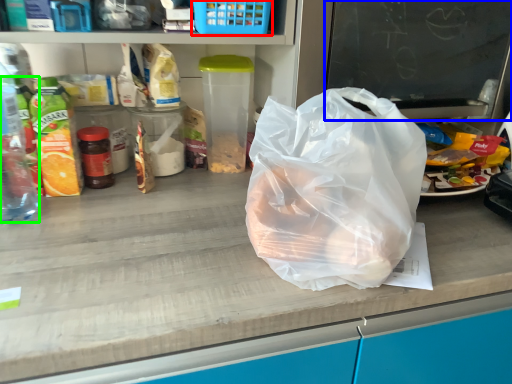
Question: Based on their relative distances, which object is nearer to basket (highlighted by a red box)? Choose from writing (highlighted by a blue box) and bottle (highlighted by a green box).

Choices:
 (A) writing
 (B) bottle

Answer: (A)